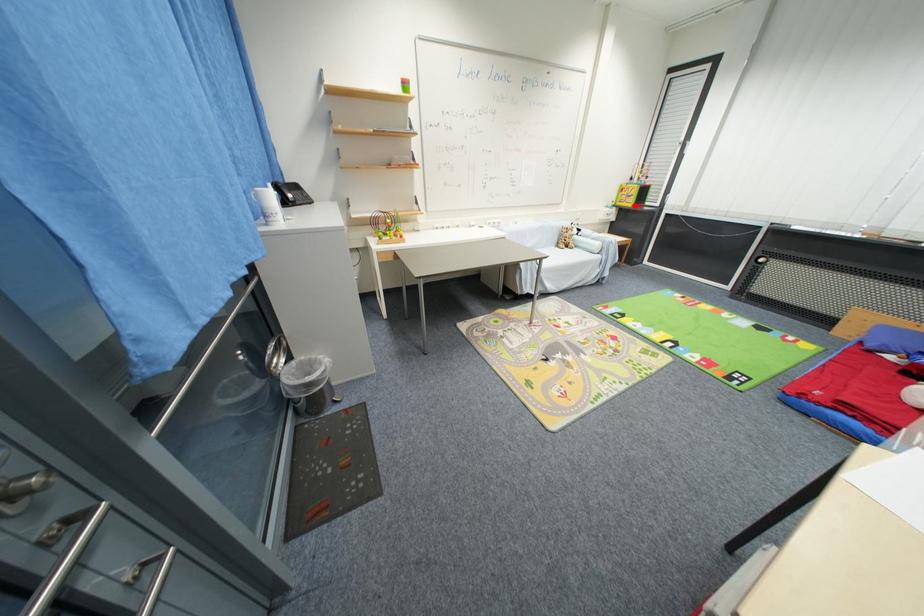
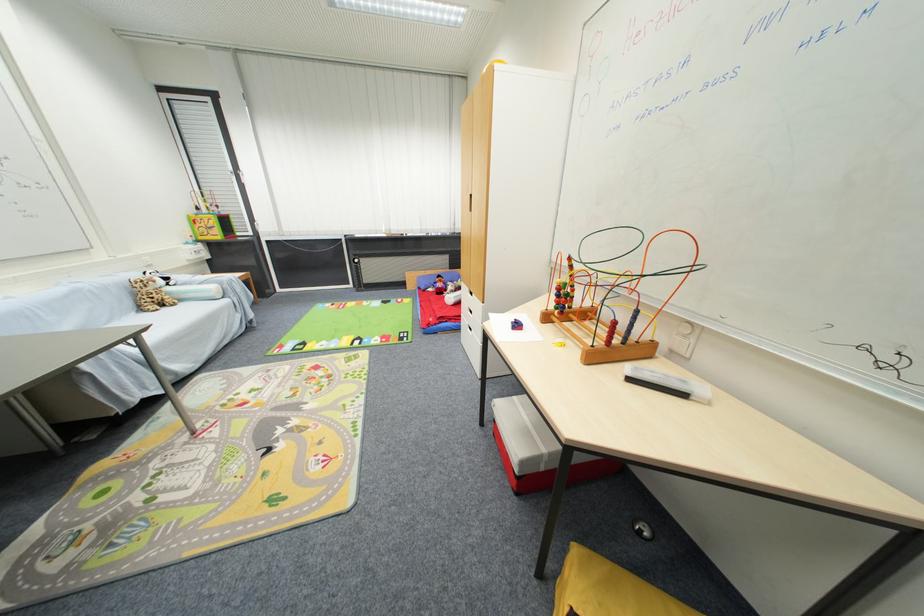
Find the pixel in the second image that matches the highlighted location in the first image.

(223, 238)